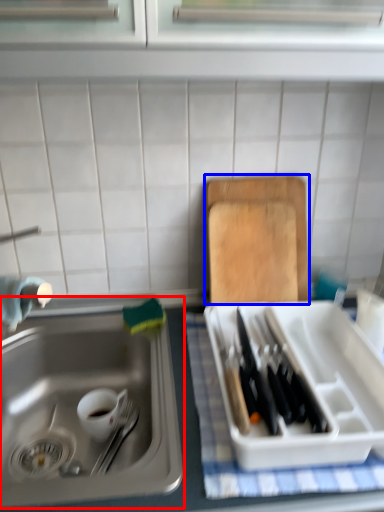
Question: Which point is further to the camera, sink (highlighted by a red box) or cutting board (highlighted by a blue box)?

Choices:
 (A) sink
 (B) cutting board

Answer: (B)